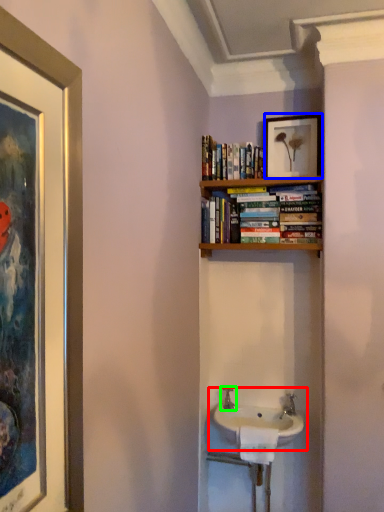
Question: Based on their relative distances, which object is farther from sink (highlighted by a red box)? Choose from picture frame (highlighted by a blue box) and tap (highlighted by a green box).

Choices:
 (A) picture frame
 (B) tap

Answer: (A)